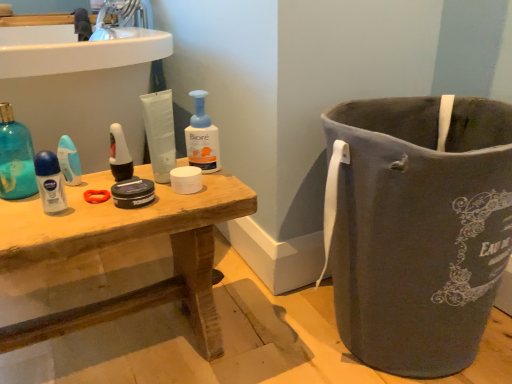
Where is `free spot to the right of blue plastic razor at center`? This screenshot has height=384, width=512. free spot to the right of blue plastic razor at center is located at coordinates (141, 176).